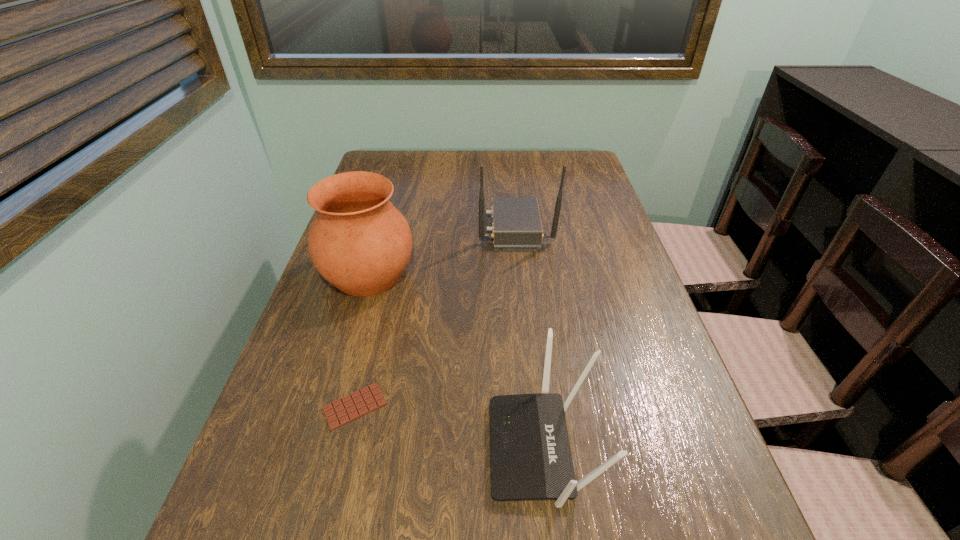
The height and width of the screenshot is (540, 960). I want to click on the closest object to the candy bar, so click(530, 454).